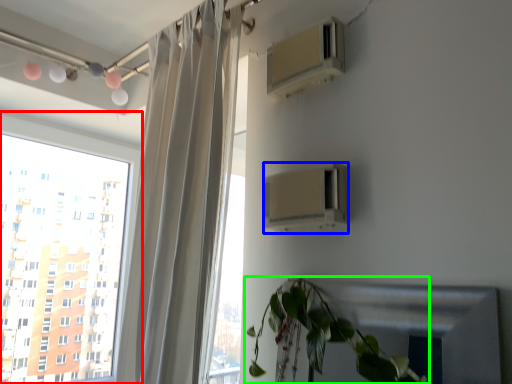
Question: Considering the real-world distances, which object is farthest from window (highlighted by a red box)? air conditioning (highlighted by a blue box) or houseplant (highlighted by a green box)?

Choices:
 (A) air conditioning
 (B) houseplant

Answer: (B)